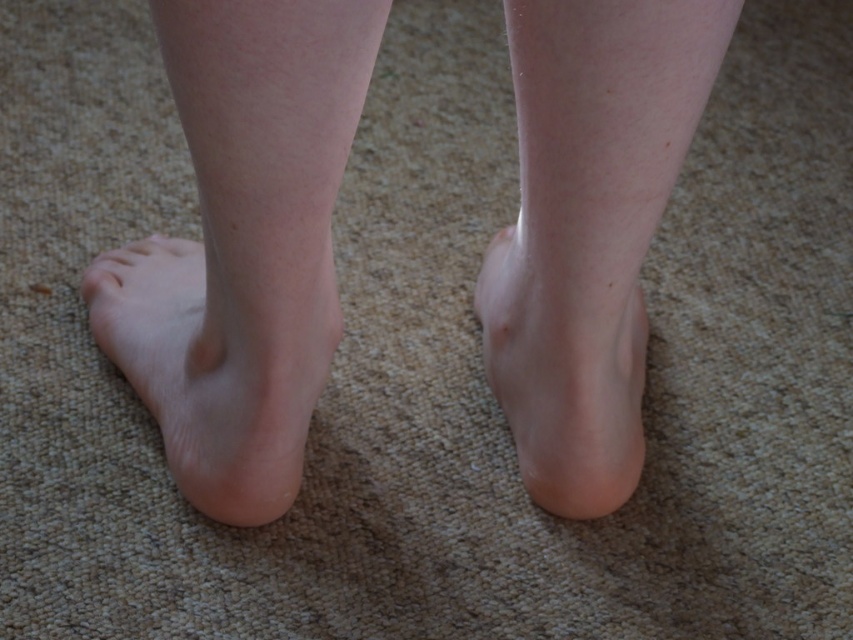
Consider the image. You are a photographer adjusting lighting for a closeup shot of two feet on a carpet. The scene includes the skin smooth feet at center and the smooth skin foot at center. Which object would cast a longer shadow under the same lighting conditions?

The skin smooth feet at center would cast a longer shadow than the smooth skin foot at center because it is much taller.

You are a photographer setting up a shoot and need to position a small prop exactly 0.5 meters to the right of the skin smooth feet at center. Given that the coordinate system starts at the bottom left corner of the image, what are the coordinates where you should place the prop?

The skin smooth feet at center is located at point [242,244]. To place the prop 0.5 meters to the right, add 0.5 to the x coordinate. The new coordinates would be [242,564].